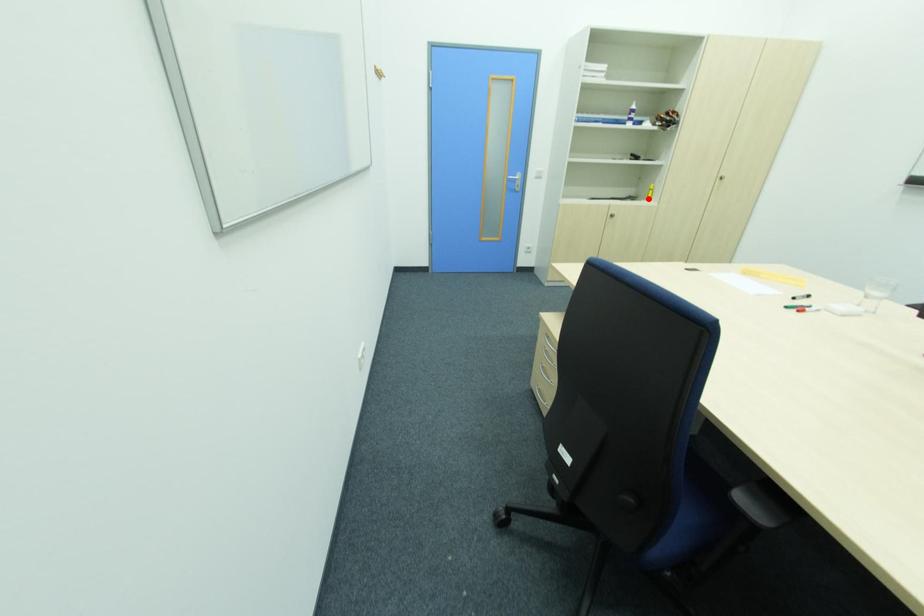
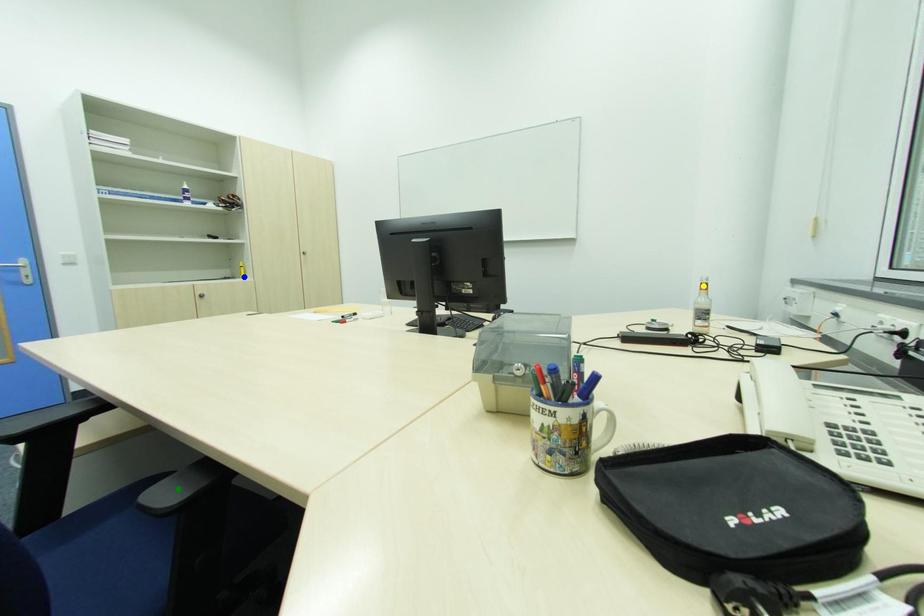
Question: I am providing you with two images of the same scene from different viewpoints. A red point is marked on the first image. You are given multiple points on the second image. Which spot in image 2 lines up with the point in image 1?

Choices:
 (A) yellow point
 (B) green point
 (C) blue point

Answer: (C)